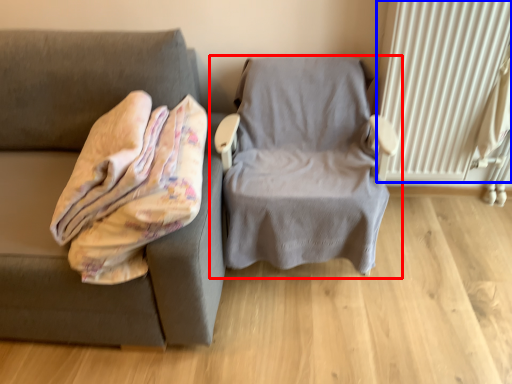
Question: Which object is further to the camera taking this photo, chair (highlighted by a red box) or radiator (highlighted by a blue box)?

Choices:
 (A) chair
 (B) radiator

Answer: (B)